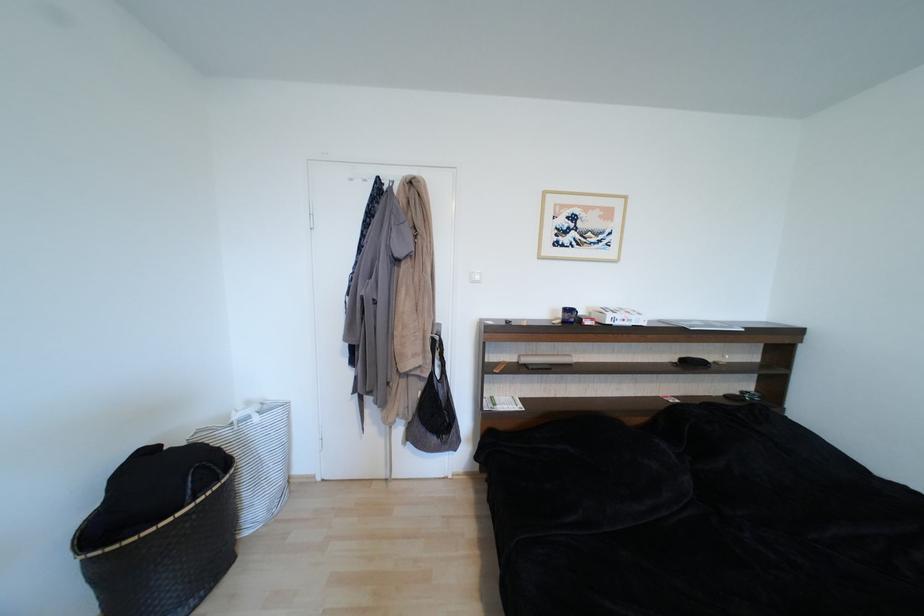
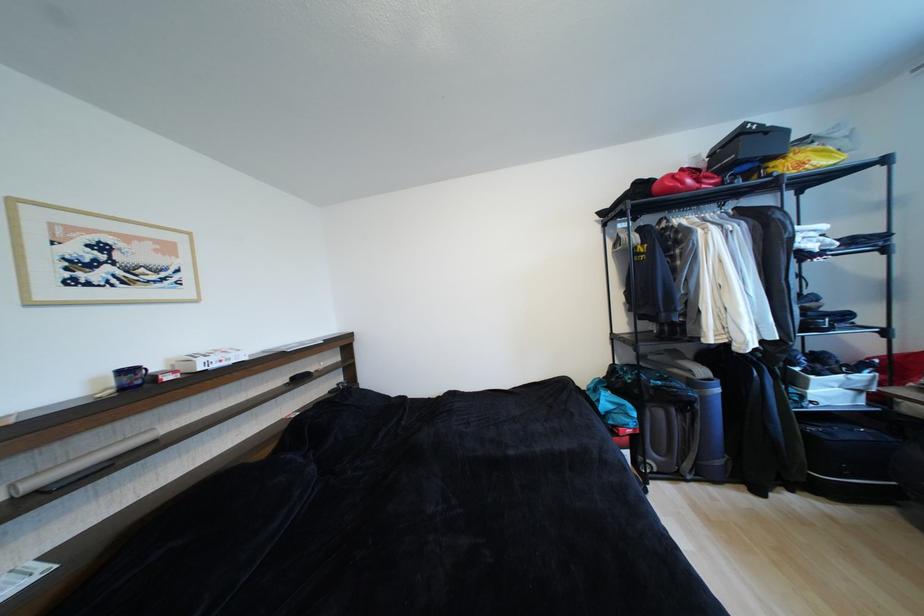
Question: Based on the continuous images, in which direction is the camera rotating? Reply with the corresponding letter.

Choices:
 (A) Left
 (B) Right
 (C) Up
 (D) Down

Answer: (B)